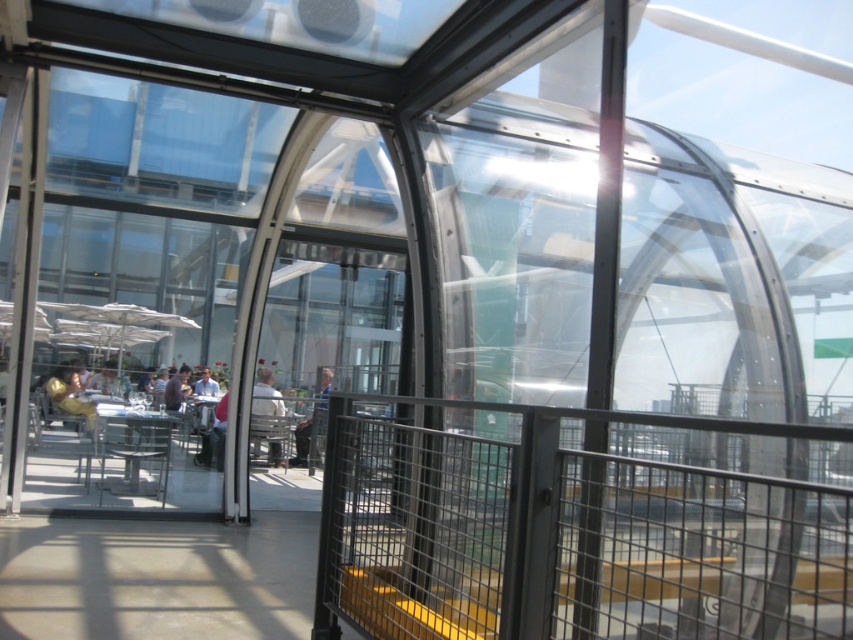
Question: Can you confirm if transparent glass door at center is positioned below light brown leather jacket at center?

Choices:
 (A) no
 (B) yes

Answer: (A)

Question: Which object is farther from the camera taking this photo?

Choices:
 (A) blue denim jeans at center
 (B) golden yellow jacket at left

Answer: (B)

Question: Which point is closer to the camera?

Choices:
 (A) transparent glass door at center
 (B) golden yellow jacket at left
 (C) light brown leather jacket at center
 (D) blue denim jeans at center

Answer: (A)

Question: Can you confirm if golden yellow jacket at left is bigger than light brown leather jacket at center?

Choices:
 (A) no
 (B) yes

Answer: (B)

Question: Which object appears farthest from the camera in this image?

Choices:
 (A) light brown leather jacket at center
 (B) black wire mesh railing at center
 (C) golden yellow jacket at left

Answer: (C)

Question: Can you confirm if black wire mesh railing at center is positioned to the left of light brown leather jacket at center?

Choices:
 (A) no
 (B) yes

Answer: (A)